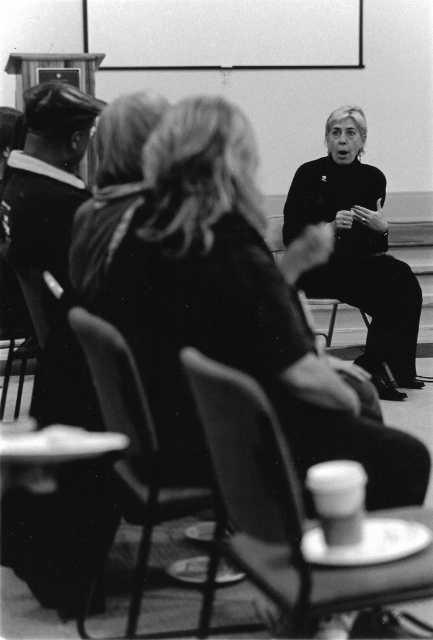
Can you confirm if smooth plastic cup at lower center is positioned above smooth plastic chair at center?

Incorrect, smooth plastic cup at lower center is not positioned above smooth plastic chair at center.

Can you confirm if smooth plastic cup at lower center is positioned to the right of smooth plastic chair at center?

Correct, you'll find smooth plastic cup at lower center to the right of smooth plastic chair at center.

At what (x,y) coordinates should I click in order to perform the action: click on smooth plastic cup at lower center. Please return your answer as a coordinate pair (x, y). Looking at the image, I should click on (277, 508).

Is point (38, 225) positioned in front of point (132, 461)?

That is False.

Image resolution: width=433 pixels, height=640 pixels. What are the coordinates of `smooth black hat at left` in the screenshot? It's located at (45, 179).

Based on the photo, who is more forward, (181, 353) or (374, 172)?

Point (181, 353) is more forward.

Can you confirm if smooth plastic cup at lower center is positioned to the left of black matte turtleneck at center?

Yes, smooth plastic cup at lower center is to the left of black matte turtleneck at center.

Describe the element at coordinates (277, 508) in the screenshot. This screenshot has height=640, width=433. I see `smooth plastic cup at lower center` at that location.

You are a GUI agent. You are given a task and a screenshot of the screen. Output one action in this format:
    pyautogui.click(x=<x>, y=<y>)
    Task: Click on the smooth plastic cup at lower center
    The width and height of the screenshot is (433, 640).
    Given the screenshot: What is the action you would take?
    pyautogui.click(x=277, y=508)